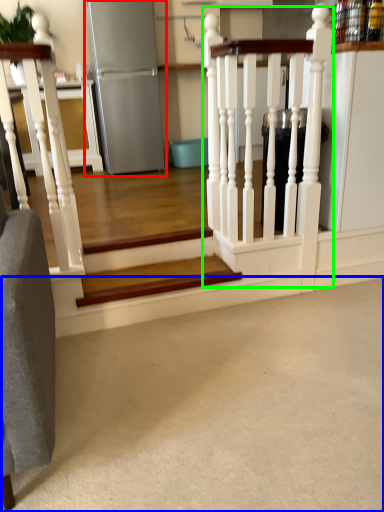
Question: Considering the real-world distances, which object is closest to appliance (highlighted by a red box)? concrete (highlighted by a blue box) or rail (highlighted by a green box).

Choices:
 (A) concrete
 (B) rail

Answer: (B)